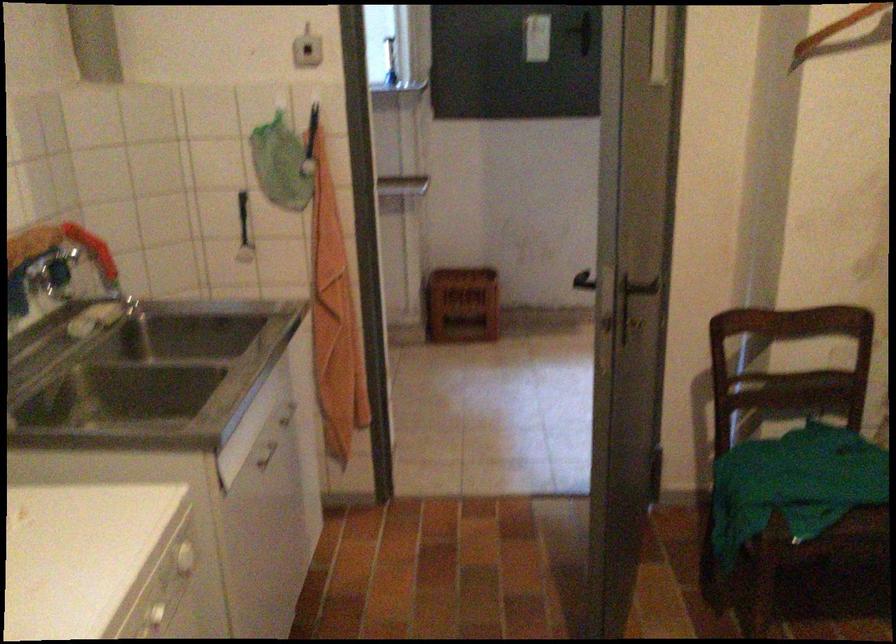
This screenshot has width=896, height=644. Find the location of `dark door handle`. dark door handle is located at coordinates (634, 292).